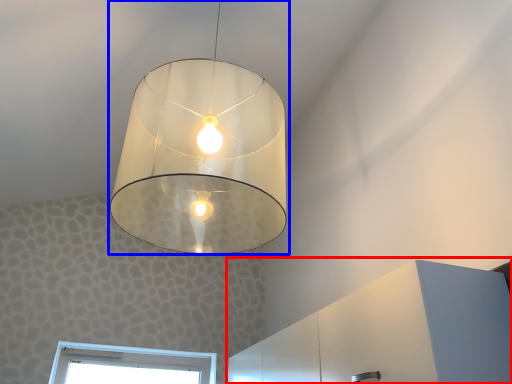
Question: Among these objects, which one is farthest to the camera, dresser (highlighted by a red box) or lamp (highlighted by a blue box)?

Choices:
 (A) dresser
 (B) lamp

Answer: (A)